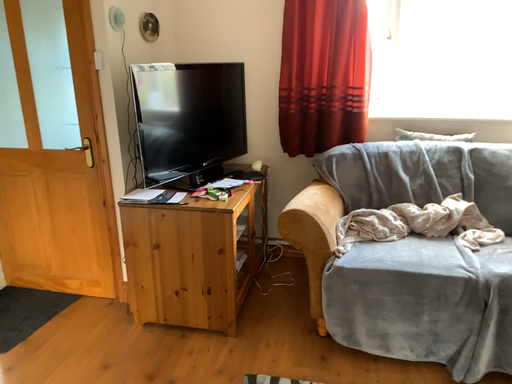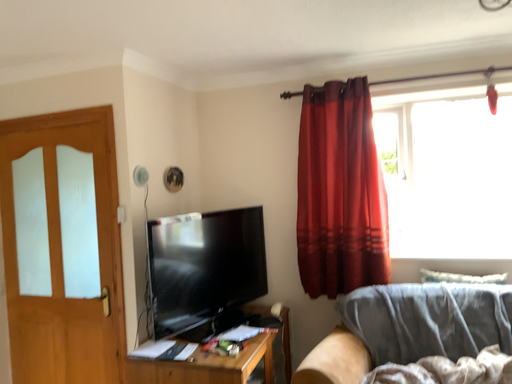
Question: Which way did the camera rotate in the video?

Choices:
 (A) rotated downward
 (B) rotated upward

Answer: (B)